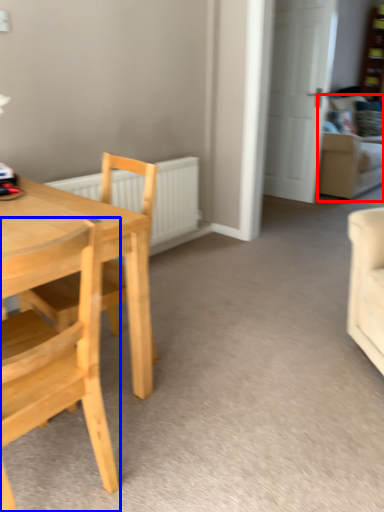
Question: Which point is closer to the camera, couch (highlighted by a red box) or chair (highlighted by a blue box)?

Choices:
 (A) couch
 (B) chair

Answer: (B)